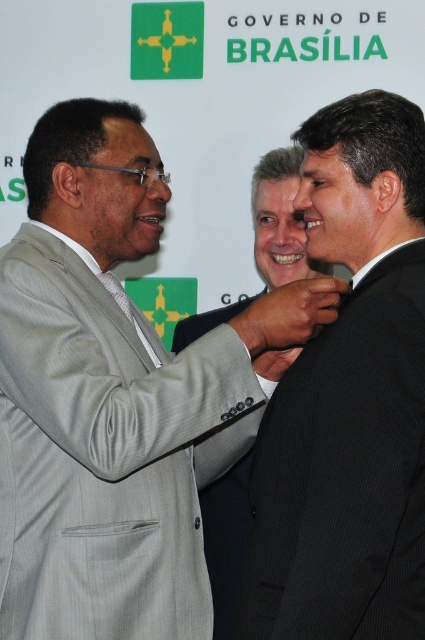
Question: Which point is closer to the camera taking this photo?

Choices:
 (A) (272, 355)
 (B) (223, 480)
 (C) (348, 218)
 (D) (209, 410)

Answer: (C)

Question: Among these objects, which one is farthest from the camera?

Choices:
 (A) matte black hand at center
 (B) light gray pinstripe suit at center

Answer: (A)

Question: Estimate the real-world distances between objects in this image. Which object is closer to the black pinstripe suit at center?

Choices:
 (A) black textured suit at center
 (B) light gray pinstripe suit at center
 (C) dark brown leather hand at center

Answer: (C)

Question: Is light gray pinstripe suit at center wider than matte black hand at center?

Choices:
 (A) no
 (B) yes

Answer: (B)

Question: Is black pinstripe suit at center thinner than black textured suit at center?

Choices:
 (A) no
 (B) yes

Answer: (B)

Question: Is black pinstripe suit at center further to the viewer compared to black textured suit at center?

Choices:
 (A) yes
 (B) no

Answer: (B)